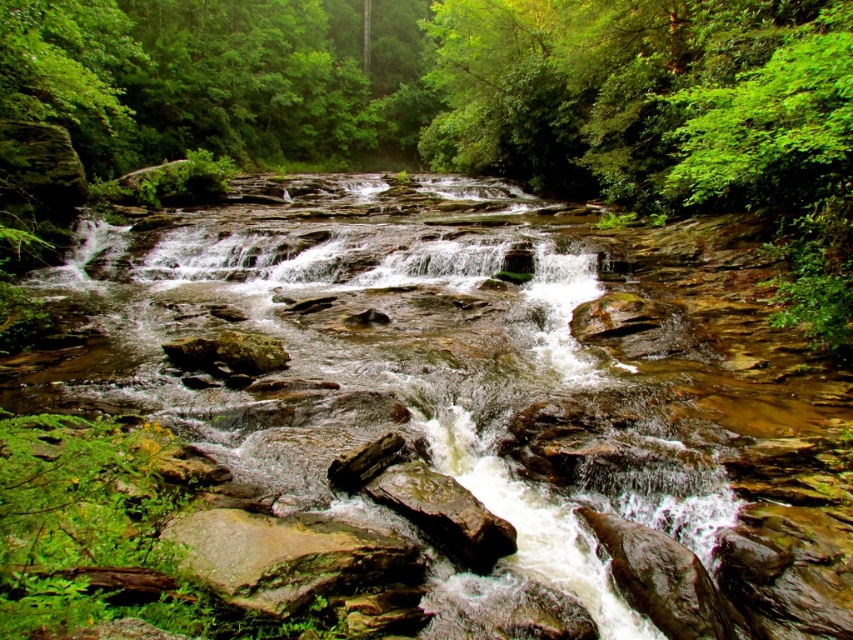
Describe the element at coordinates (492, 394) in the screenshot. I see `brown rock mountain stream at center` at that location.

Consider the image. Who is more forward, (91, 273) or (265, 371)?

Point (265, 371) is in front.

Describe the element at coordinates (492, 394) in the screenshot. I see `brown rock mountain stream at center` at that location.

This screenshot has height=640, width=853. I want to click on brown rock mountain stream at center, so click(492, 394).